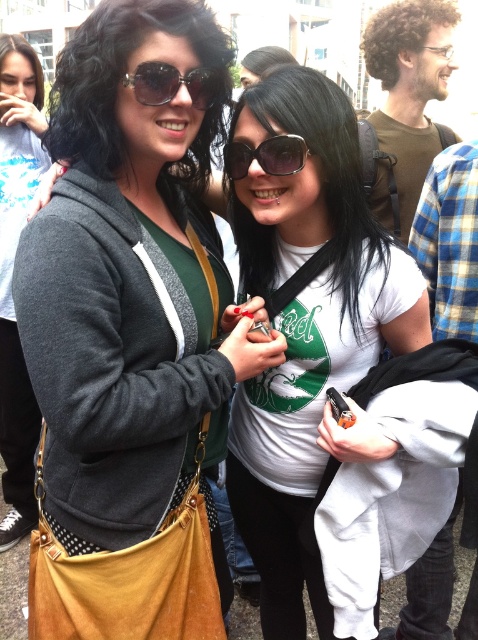
Is matte black hoodie at center closer to the viewer compared to white matte t-shirt at center?

Yes, it is.

Which is behind, point (141, 561) or point (249, 147)?

Point (249, 147)

Which is in front, point (153, 108) or point (288, 266)?

Point (153, 108)

The image size is (478, 640). I want to click on matte black hoodie at center, so click(130, 340).

Does matte black hoodie at center lie behind matte black sunglasses at upper left?

No, matte black hoodie at center is closer to the viewer.

Does matte black hoodie at center appear on the right side of matte black sunglasses at upper left?

In fact, matte black hoodie at center is to the left of matte black sunglasses at upper left.

Is point (143, 260) closer to viewer compared to point (87, 116)?

No, it is behind (87, 116).

I want to click on matte black hoodie at center, so click(130, 340).

Identify the location of matte black jacket at center. The image size is (478, 640). (10, 275).

Does matte black jacket at center have a greater height compared to matte black sunglasses at upper center?

Indeed, matte black jacket at center has a greater height compared to matte black sunglasses at upper center.

Consider the image. Who is more distant from viewer, (17, 198) or (158, 77)?

Point (17, 198)

The width and height of the screenshot is (478, 640). Find the location of `matte black jacket at center`. matte black jacket at center is located at coordinates (10, 275).